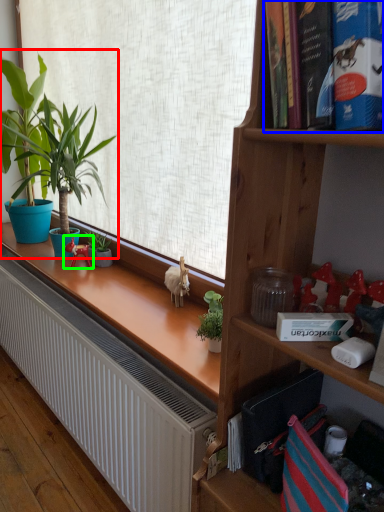
Question: Which object is the farthest from houseplant (highlighted by a red box)? Choose among these: book (highlighted by a blue box) or toy (highlighted by a green box).

Choices:
 (A) book
 (B) toy

Answer: (A)